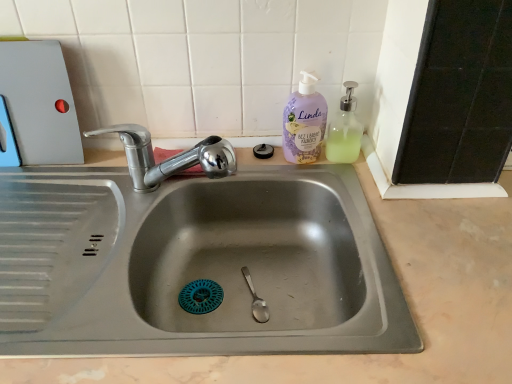
The image size is (512, 384). Describe the element at coordinates (169, 158) in the screenshot. I see `chrome metallic faucet at upper left` at that location.

You are a GUI agent. You are given a task and a screenshot of the screen. Output one action in this format:
    pyautogui.click(x=<x>, y=<y>)
    Task: Click on the chrome metallic faucet at upper left
    
    Given the screenshot: What is the action you would take?
    pyautogui.click(x=169, y=158)

Image resolution: width=512 pixels, height=384 pixels. What are the coordinates of `lavender-colored pump bottle at upper right` in the screenshot? It's located at (304, 122).

Image resolution: width=512 pixels, height=384 pixels. Find the location of `matte plastic cutting board at upper left`. matte plastic cutting board at upper left is located at coordinates (40, 102).

Is point (348, 106) less distant than point (130, 159)?

No, (348, 106) is further to viewer.

Between clear plastic soap dispenser at upper right and chrome metallic faucet at upper left, which one has larger size?

With larger size is chrome metallic faucet at upper left.

Between clear plastic soap dispenser at upper right and chrome metallic faucet at upper left, which one is positioned behind?

clear plastic soap dispenser at upper right is behind.

Is clear plastic soap dispenser at upper right thinner than chrome metallic faucet at upper left?

Yes, clear plastic soap dispenser at upper right is thinner than chrome metallic faucet at upper left.

Consider the image. Does chrome metallic faucet at upper left have a lesser width compared to clear plastic soap dispenser at upper right?

No, chrome metallic faucet at upper left is not thinner than clear plastic soap dispenser at upper right.

Considering their positions, is chrome metallic faucet at upper left located in front of or behind clear plastic soap dispenser at upper right?

chrome metallic faucet at upper left is in front of clear plastic soap dispenser at upper right.

Is chrome metallic faucet at upper left far away from clear plastic soap dispenser at upper right?

No, chrome metallic faucet at upper left is in close proximity to clear plastic soap dispenser at upper right.

Relative to clear plastic soap dispenser at upper right, is matte plastic cutting board at upper left in front or behind?

matte plastic cutting board at upper left is in front of clear plastic soap dispenser at upper right.

In terms of size, does matte plastic cutting board at upper left appear bigger or smaller than clear plastic soap dispenser at upper right?

Considering their sizes, matte plastic cutting board at upper left takes up more space than clear plastic soap dispenser at upper right.

Which is more to the left, matte plastic cutting board at upper left or clear plastic soap dispenser at upper right?

From the viewer's perspective, matte plastic cutting board at upper left appears more on the left side.

Which object is wider, clear plastic soap dispenser at upper right or matte plastic cutting board at upper left?

Wider between the two is clear plastic soap dispenser at upper right.

Who is more distant, clear plastic soap dispenser at upper right or matte plastic cutting board at upper left?

clear plastic soap dispenser at upper right is behind.

Consider the image. Do you think clear plastic soap dispenser at upper right is within matte plastic cutting board at upper left, or outside of it?

clear plastic soap dispenser at upper right is spatially situated outside matte plastic cutting board at upper left.

Based on the photo, can you confirm if clear plastic soap dispenser at upper right is smaller than matte plastic cutting board at upper left?

Indeed, clear plastic soap dispenser at upper right has a smaller size compared to matte plastic cutting board at upper left.

Considering the points (228, 159) and (304, 77), which point is behind, point (228, 159) or point (304, 77)?

The point (304, 77) is farther from the camera.

At what (x,y) coordinates should I click in order to perform the action: click on tap in front of the lavender-colored pump bottle at upper right. Please return your answer as a coordinate pair (x, y). The width and height of the screenshot is (512, 384). Looking at the image, I should click on (169, 158).

From the image's perspective, does chrome metallic faucet at upper left appear higher than lavender-colored pump bottle at upper right?

Incorrect, from the image's perspective, chrome metallic faucet at upper left is lower than lavender-colored pump bottle at upper right.

From a real-world perspective, does clear plastic soap dispenser at upper right sit lower than lavender-colored pump bottle at upper right?

Yes, from a real-world perspective, clear plastic soap dispenser at upper right is under lavender-colored pump bottle at upper right.

Between clear plastic soap dispenser at upper right and lavender-colored pump bottle at upper right, which one has smaller width?

With smaller width is lavender-colored pump bottle at upper right.

Does point (335, 118) come farther from viewer compared to point (308, 93)?

Yes, point (335, 118) is behind point (308, 93).

Can you confirm if chrome metallic faucet at upper left is shorter than matte plastic cutting board at upper left?

Yes, chrome metallic faucet at upper left is shorter than matte plastic cutting board at upper left.

Considering the relative sizes of chrome metallic faucet at upper left and matte plastic cutting board at upper left in the image provided, is chrome metallic faucet at upper left smaller than matte plastic cutting board at upper left?

Yes, chrome metallic faucet at upper left is smaller than matte plastic cutting board at upper left.

Can you confirm if chrome metallic faucet at upper left is thinner than matte plastic cutting board at upper left?

Incorrect, the width of chrome metallic faucet at upper left is not less than that of matte plastic cutting board at upper left.

This screenshot has height=384, width=512. What are the coordinates of `soap dispenser above the chrome metallic faucet at upper left (from a real-world perspective)` in the screenshot? It's located at (345, 130).

The height and width of the screenshot is (384, 512). Find the location of `soap dispenser on the right of chrome metallic faucet at upper left`. soap dispenser on the right of chrome metallic faucet at upper left is located at coordinates (345, 130).

Estimate the real-world distances between objects in this image. Which object is further from clear plastic soap dispenser at upper right, matte plastic cutting board at upper left or chrome metallic faucet at upper left?

matte plastic cutting board at upper left lies further to clear plastic soap dispenser at upper right than the other object.

Which object lies nearer to the anchor point clear plastic soap dispenser at upper right, chrome metallic faucet at upper left or lavender-colored pump bottle at upper right?

lavender-colored pump bottle at upper right is closer to clear plastic soap dispenser at upper right.

Looking at the image, which one is located closer to chrome metallic faucet at upper left, clear plastic soap dispenser at upper right or matte plastic cutting board at upper left?

matte plastic cutting board at upper left.

Which object lies nearer to the anchor point matte plastic cutting board at upper left, lavender-colored pump bottle at upper right or clear plastic soap dispenser at upper right?

The object closer to matte plastic cutting board at upper left is lavender-colored pump bottle at upper right.

Which object lies further to the anchor point chrome metallic faucet at upper left, lavender-colored pump bottle at upper right or matte plastic cutting board at upper left?

Among the two, lavender-colored pump bottle at upper right is located further to chrome metallic faucet at upper left.

Which object lies further to the anchor point clear plastic soap dispenser at upper right, lavender-colored pump bottle at upper right or chrome metallic faucet at upper left?

chrome metallic faucet at upper left.

From the image, which object appears to be nearer to matte plastic cutting board at upper left, clear plastic soap dispenser at upper right or chrome metallic faucet at upper left?

The object closer to matte plastic cutting board at upper left is chrome metallic faucet at upper left.

Estimate the real-world distances between objects in this image. Which object is closer to chrome metallic faucet at upper left, matte plastic cutting board at upper left or lavender-colored pump bottle at upper right?

matte plastic cutting board at upper left.

Image resolution: width=512 pixels, height=384 pixels. I want to click on tap between matte plastic cutting board at upper left and clear plastic soap dispenser at upper right, so click(169, 158).

At what (x,y) coordinates should I click in order to perform the action: click on cleaning product between matte plastic cutting board at upper left and clear plastic soap dispenser at upper right in the horizontal direction. Please return your answer as a coordinate pair (x, y). Looking at the image, I should click on pos(304,122).

You are a GUI agent. You are given a task and a screenshot of the screen. Output one action in this format:
    pyautogui.click(x=<x>, y=<y>)
    Task: Click on the cleaning product located between chrome metallic faucet at upper left and clear plastic soap dispenser at upper right in the left-right direction
    The image size is (512, 384).
    Given the screenshot: What is the action you would take?
    pyautogui.click(x=304, y=122)

Identify the location of tap between matte plastic cutting board at upper left and lavender-colored pump bottle at upper right from left to right. The width and height of the screenshot is (512, 384). (169, 158).